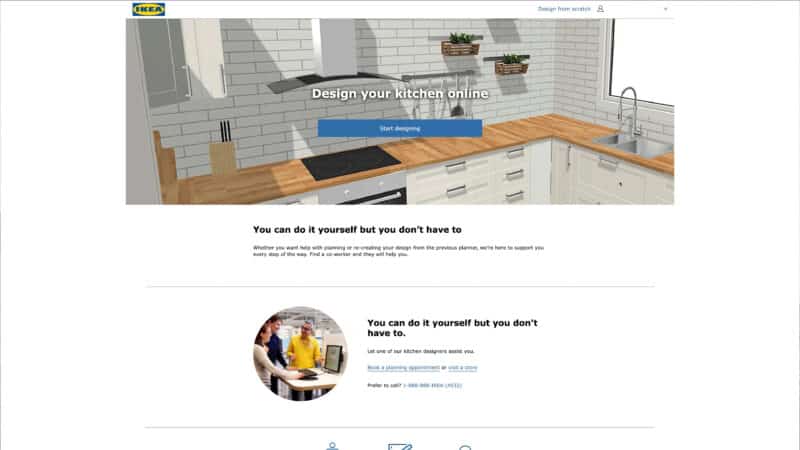
You are a GUI agent. You are given a task and a screenshot of the screen. Output one action in this format:
    pyautogui.click(x=<x>, y=<y>)
    Task: Click on the kitchen sink
    
    Given the screenshot: What is the action you would take?
    (x=630, y=141)